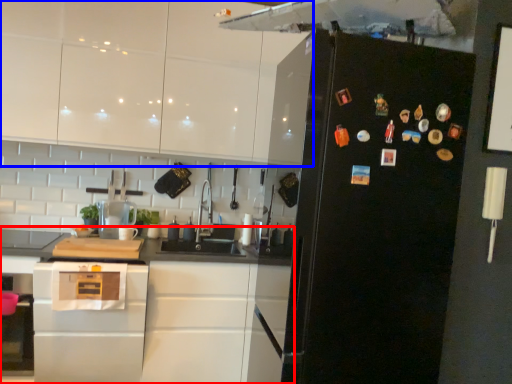
Question: Among these objects, which one is nearest to the camera, cabinetry (highlighted by a red box) or cabinetry (highlighted by a blue box)?

Choices:
 (A) cabinetry
 (B) cabinetry

Answer: (A)